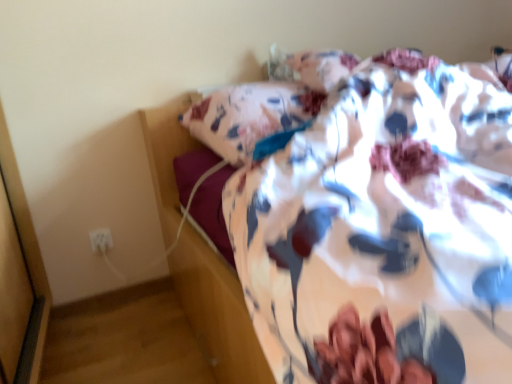
Describe the element at coordinates (101, 239) in the screenshot. I see `white plastic electric outlet at lower left` at that location.

The height and width of the screenshot is (384, 512). I want to click on white plastic electric outlet at lower left, so click(x=101, y=239).

This screenshot has width=512, height=384. I want to click on white plastic electric outlet at lower left, so click(x=101, y=239).